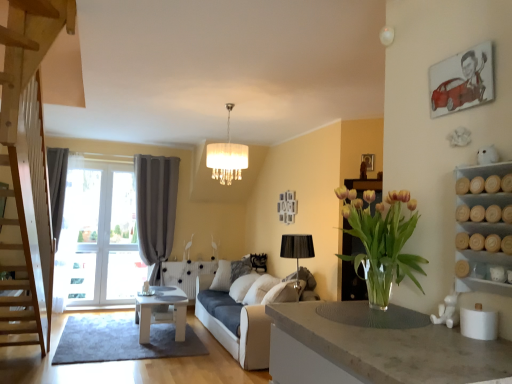
Question: Is gray fabric curtain at left in front of or behind translucent glass vase at center in the image?

Choices:
 (A) front
 (B) behind

Answer: (B)

Question: From their relative heights in the image, would you say gray fabric curtain at left is taller or shorter than translucent glass vase at center?

Choices:
 (A) short
 (B) tall

Answer: (B)

Question: Considering the real-world distances, which object is farthest from the gray fabric curtain at left?

Choices:
 (A) white textured pillow at center
 (B) translucent glass vase at center
 (C) wooden picture frame at upper center
 (D) white fabric couch at center
 (E) white fabric lampshade at center

Answer: (B)

Question: Which of these objects is positioned farthest from the white fabric lampshade at center?

Choices:
 (A) translucent glass vase at center
 (B) white textured pillow at center
 (C) gray fabric curtain at left
 (D) wooden picture frame at upper center
 (E) white fabric couch at center

Answer: (C)